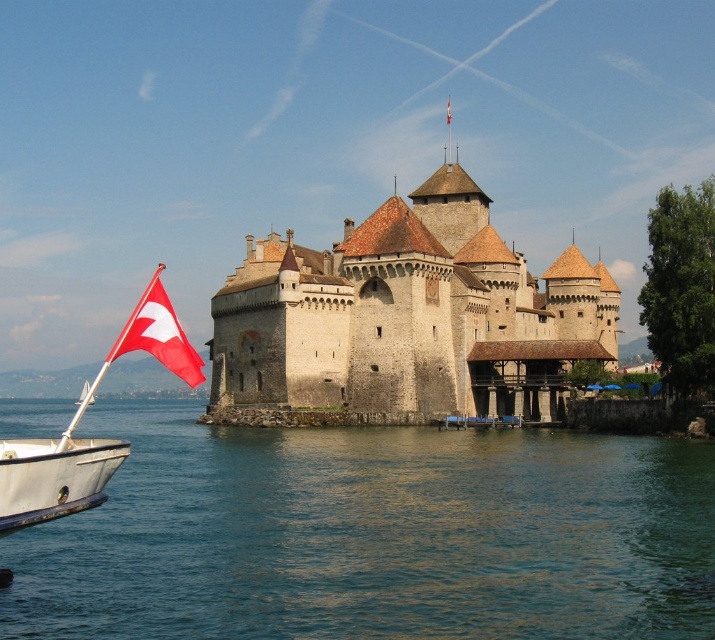
Question: Is clear blue water at lower left smaller than red fabric flag at left?

Choices:
 (A) no
 (B) yes

Answer: (B)

Question: Which object is closer to the camera taking this photo?

Choices:
 (A) red fabric flag at center
 (B) red fabric flag at left
 (C) stone medieval castle at center
 (D) clear blue water at lower left

Answer: (D)

Question: Which point is closer to the camera?

Choices:
 (A) red fabric flag at left
 (B) stone medieval castle at center
 (C) red fabric flag at center

Answer: (A)

Question: Does clear blue water at lower left have a smaller size compared to stone medieval castle at center?

Choices:
 (A) yes
 (B) no

Answer: (A)

Question: Among these points, which one is farthest from the camera?

Choices:
 (A) (608, 275)
 (B) (448, 112)

Answer: (B)

Question: Can you confirm if clear blue water at lower left is thinner than red fabric flag at left?

Choices:
 (A) yes
 (B) no

Answer: (B)